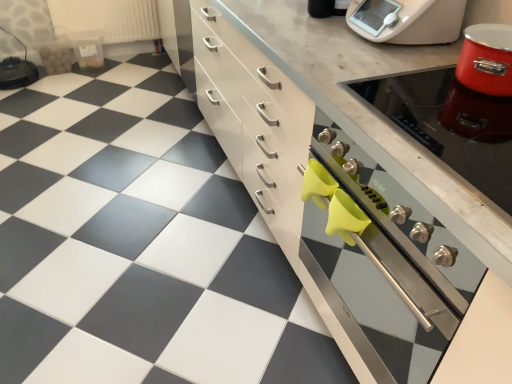
Question: Is metallic silver oven at right smaller than white plastic food processor at upper right?

Choices:
 (A) no
 (B) yes

Answer: (A)

Question: Considering the relative positions of metallic silver oven at right and white plastic food processor at upper right in the image provided, is metallic silver oven at right to the left of white plastic food processor at upper right from the viewer's perspective?

Choices:
 (A) no
 (B) yes

Answer: (A)

Question: Are metallic silver oven at right and white plastic food processor at upper right located far from each other?

Choices:
 (A) yes
 (B) no

Answer: (B)

Question: From the image's perspective, is metallic silver oven at right above white plastic food processor at upper right?

Choices:
 (A) yes
 (B) no

Answer: (B)

Question: Is metallic silver oven at right to the right of white plastic food processor at upper right from the viewer's perspective?

Choices:
 (A) yes
 (B) no

Answer: (A)

Question: Considering the relative sizes of metallic silver oven at right and white plastic food processor at upper right in the image provided, is metallic silver oven at right thinner than white plastic food processor at upper right?

Choices:
 (A) yes
 (B) no

Answer: (B)

Question: Is white plastic radiator at upper left positioned with its back to white plastic food processor at upper right?

Choices:
 (A) yes
 (B) no

Answer: (B)

Question: Considering the relative sizes of white plastic radiator at upper left and white plastic food processor at upper right in the image provided, is white plastic radiator at upper left wider than white plastic food processor at upper right?

Choices:
 (A) yes
 (B) no

Answer: (B)

Question: Can you confirm if white plastic radiator at upper left is positioned to the left of white plastic food processor at upper right?

Choices:
 (A) yes
 (B) no

Answer: (A)

Question: Considering the relative sizes of white plastic radiator at upper left and white plastic food processor at upper right in the image provided, is white plastic radiator at upper left smaller than white plastic food processor at upper right?

Choices:
 (A) no
 (B) yes

Answer: (A)

Question: Does white plastic radiator at upper left have a lesser width compared to white plastic food processor at upper right?

Choices:
 (A) no
 (B) yes

Answer: (B)

Question: Is white plastic radiator at upper left positioned in front of white plastic food processor at upper right?

Choices:
 (A) yes
 (B) no

Answer: (B)

Question: From a real-world perspective, is white plastic food processor at upper right physically below matte white cabinet at center?

Choices:
 (A) yes
 (B) no

Answer: (B)